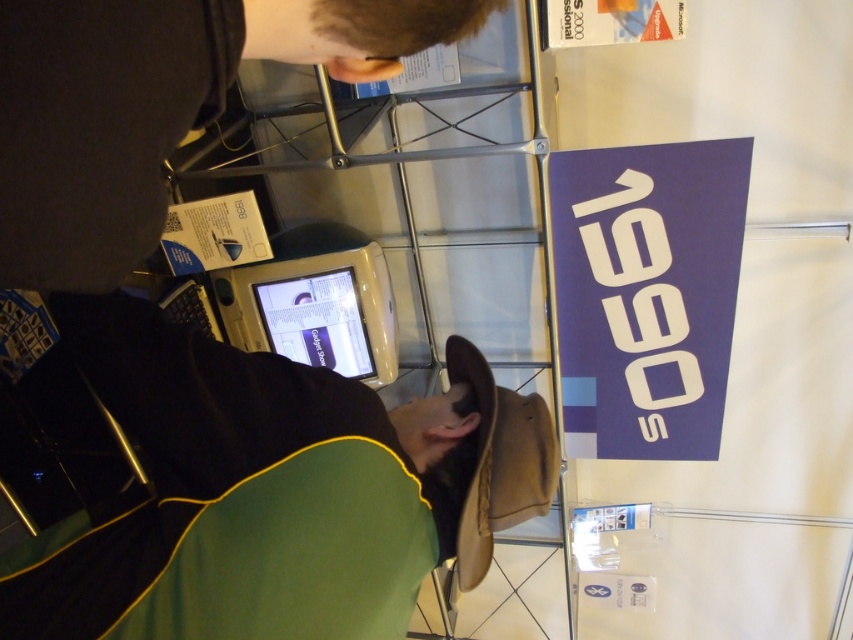
You are a visitor at the exhibition and want to read the text on the matte blue sign at upper right. However, you notice the white plastic computer at center is blocking your view. Is the sign above or below the computer?

The matte blue sign at upper right is positioned under the white plastic computer at center, so the sign is below the computer.

You are standing in front of a display case at a 1990s tech exhibition. You notice a dark brown leather jacket at upper center inside the case. If the display case is 10 inches thick, can you reach the jacket without bending down?

The dark brown leather jacket at upper center and viewer are 12.08 inches apart. Since the display case is only 10 inches thick, the jacket is 2.08 inches deeper than the case, meaning it cannot be reached without bending down or moving the case.

You are a tour guide explaining the exhibit to visitors. You need to point out the dark brown leather jacket at upper center and the white plastic computer at center. Which object is positioned to the right side of the other?

The dark brown leather jacket at upper center is to the right of the white plastic computer at center.